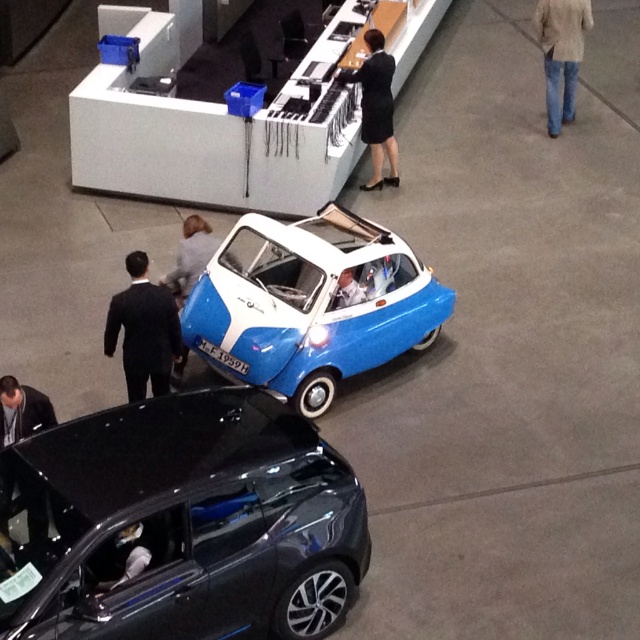
You are standing in the showroom and want to place a new poster on the wall between the two points, point [244,244] and point [349,294]. Which point is closer to you so that you can reach it first without moving your position?

Point [244,244] is further to the viewer than point [349,294], so the closer point to you is point [349,294]. You should reach that first.

You are standing in the showroom and want to find the black suit at left. Where should you look?

You should look at point (144, 330) to find the black suit at left.

You are a fashion designer observing the scene. You notice the black suit at left and the black fabric skirt at center. Which clothing item is positioned lower in the image?

The black suit at left is located below the black fabric skirt at center, so the black suit at left is positioned lower in the image.